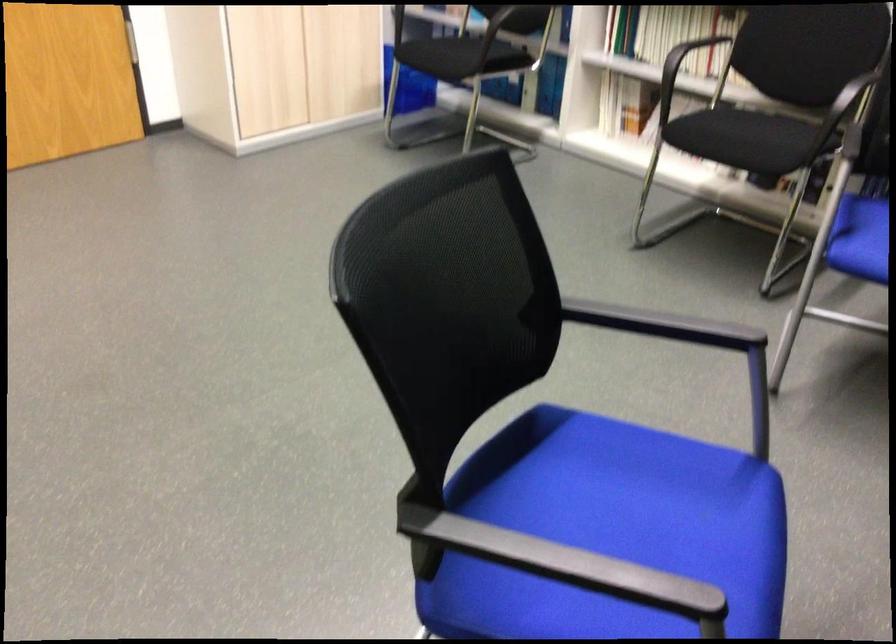
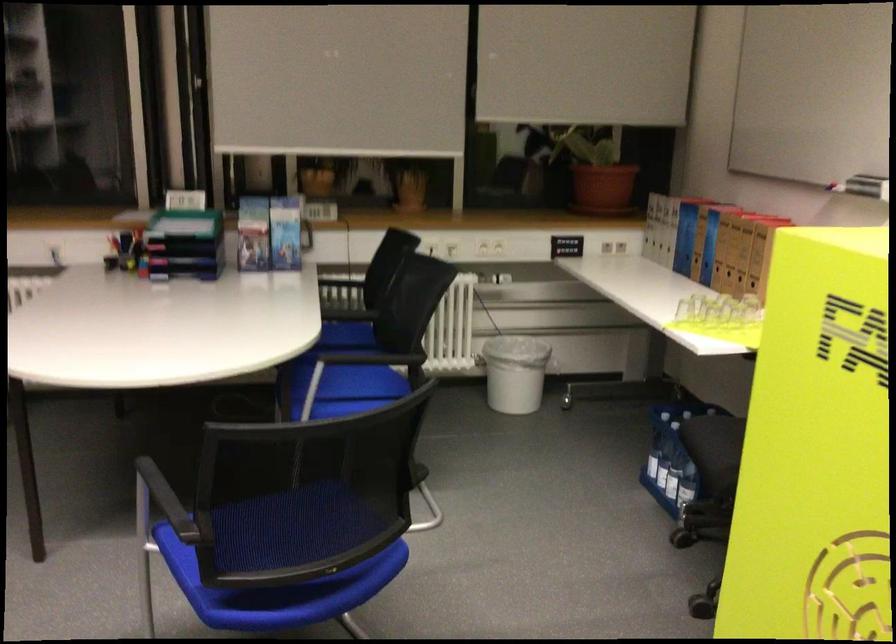
In the second image, find the point that corresponds to pixel 464 408 in the first image.

(261, 585)